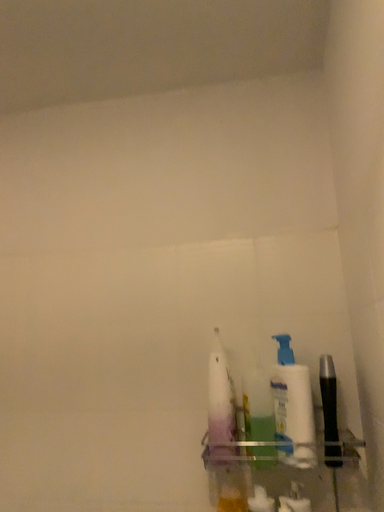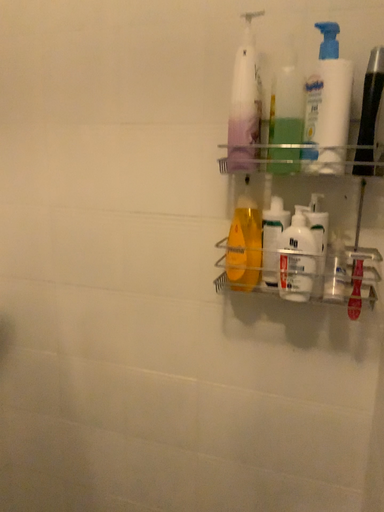
Question: Which way did the camera rotate in the video?

Choices:
 (A) rotated left
 (B) rotated right

Answer: (A)